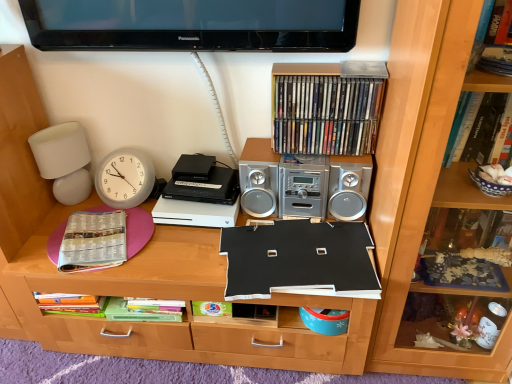
The image size is (512, 384). Find the location of `free space above black matte board at center (from a real-world perspective)`. free space above black matte board at center (from a real-world perspective) is located at coordinates (185, 229).